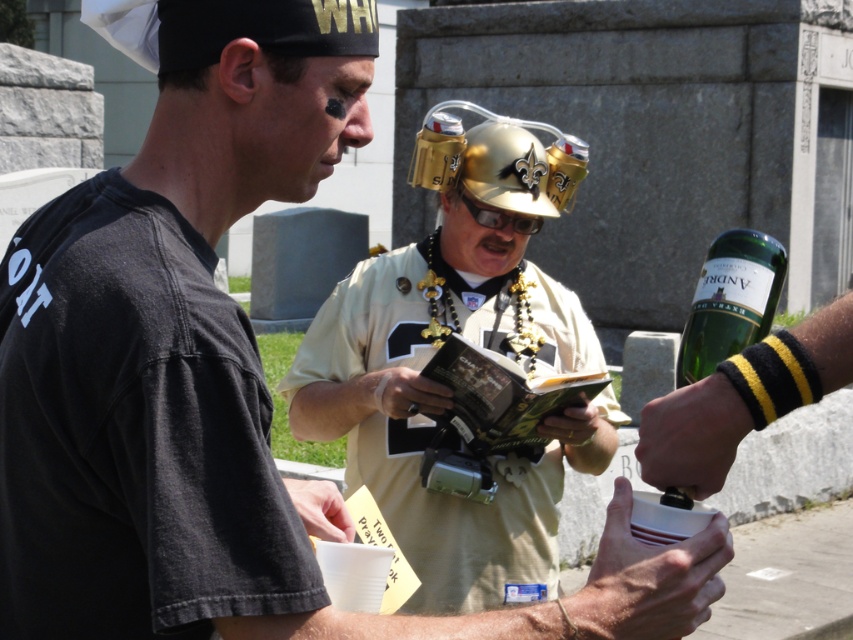
You are a photographer trying to capture a shot of the gold metallic helmet at center and the green glass bottle at upper right. From your current position, which object is closer to the left side of your camera frame?

The gold metallic helmet at center is positioned to the left of the green glass bottle at upper right, so it will appear closer to the left side of the camera frame.

You are standing at the camera position and want to hand a tool to the person wearing the gold metallic helmet at center. The tool you have is 2 meters long. Can you reach them without moving closer?

The gold metallic helmet at center is 6.41 meters away from the camera. Since the tool is only 2 meters long, you cannot reach them without moving closer.

You are a photographer standing in the cemetery and want to take a photo of the gold metallic helmet at center and the green glass bottle at upper right. Which object should you focus on first to ensure it appears sharp in the photo?

You should focus on the gold metallic helmet at center first because it is closer to you than the green glass bottle at upper right, so focusing on the closer object ensures it will be sharp.